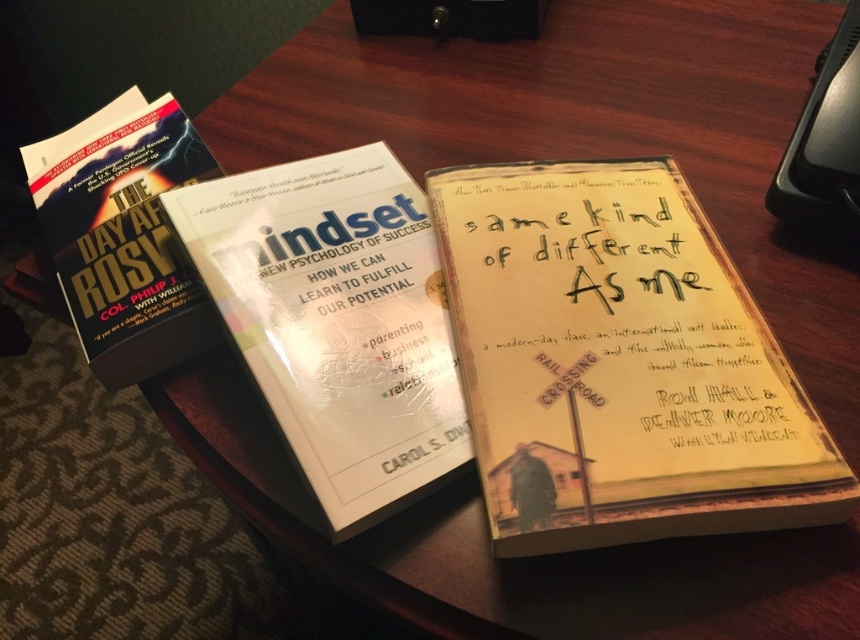
Can you confirm if yellow paper-covered book at center is taller than white glossy book at center?

No.

Describe the element at coordinates (619, 364) in the screenshot. The height and width of the screenshot is (640, 860). I see `yellow paper-covered book at center` at that location.

Find the location of a particular element. The height and width of the screenshot is (640, 860). yellow paper-covered book at center is located at coordinates (619, 364).

Does white glossy book at center have a smaller size compared to hardcover book at upper left?

Incorrect, white glossy book at center is not smaller in size than hardcover book at upper left.

Does point (303, 196) lie in front of point (106, 140)?

Yes, it is.

What are the coordinates of `white glossy book at center` in the screenshot? It's located at (336, 323).

Is yellow paper-covered book at center behind hardcover book at upper left?

No.

Is yellow paper-covered book at center below hardcover book at upper left?

Correct, yellow paper-covered book at center is located below hardcover book at upper left.

This screenshot has height=640, width=860. I want to click on yellow paper-covered book at center, so click(x=619, y=364).